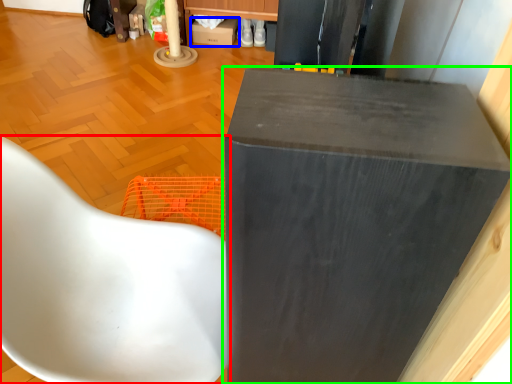
Question: Estimate the real-world distances between objects in this image. Which object is closer to chair (highlighted by a red box), cardboard box (highlighted by a blue box) or furniture (highlighted by a green box)?

Choices:
 (A) cardboard box
 (B) furniture

Answer: (B)